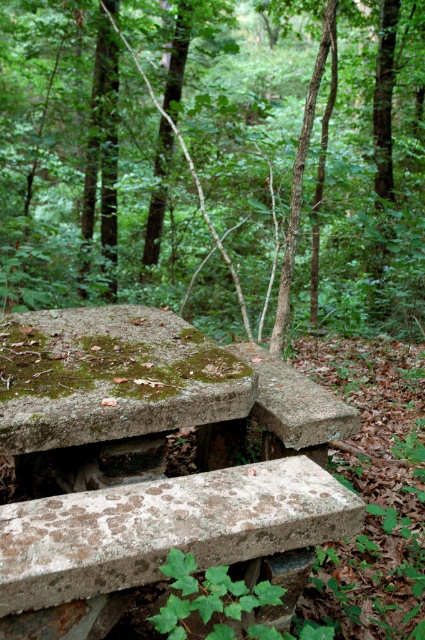
Question: Is the position of green mossy stone at lower left less distant than that of rusty concrete picnic table at upper center?

Choices:
 (A) yes
 (B) no

Answer: (B)

Question: Does green mossy stone at lower left have a greater width compared to rusty concrete picnic table at upper center?

Choices:
 (A) no
 (B) yes

Answer: (A)

Question: Which of the following is the closest to the observer?

Choices:
 (A) (48, 552)
 (B) (73, 163)

Answer: (A)

Question: Which object appears closest to the camera in this image?

Choices:
 (A) rusty concrete picnic table at upper center
 (B) green mossy stone at lower left

Answer: (A)

Question: Considering the relative positions of green mossy stone at lower left and rusty concrete picnic table at upper center in the image provided, where is green mossy stone at lower left located with respect to rusty concrete picnic table at upper center?

Choices:
 (A) below
 (B) above

Answer: (B)